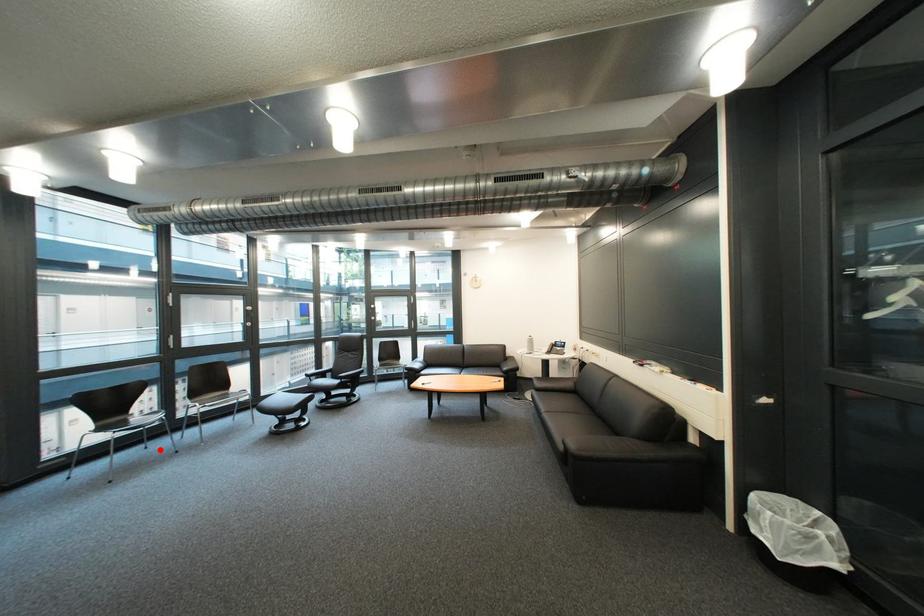
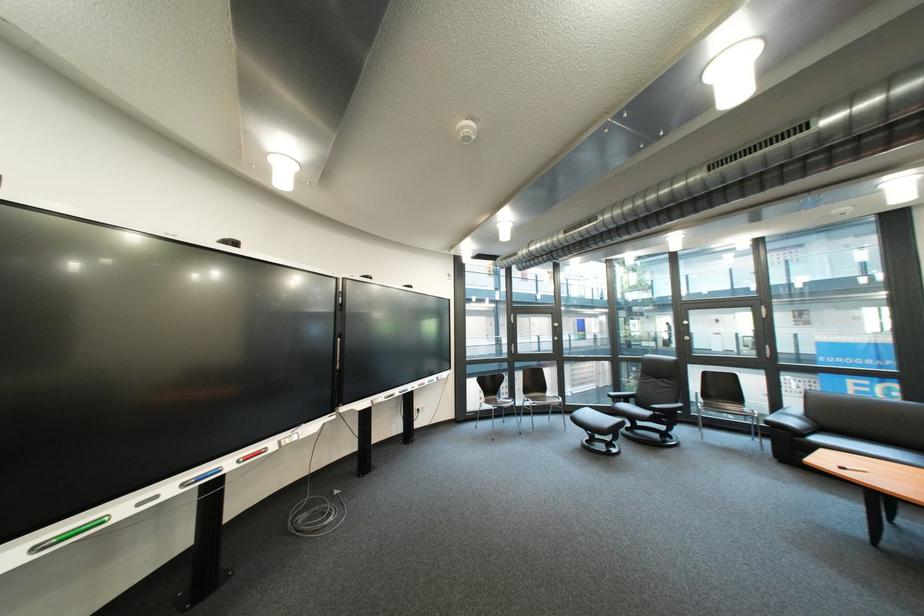
In the second image, find the point that corresponds to the highlighted location in the first image.

(517, 424)